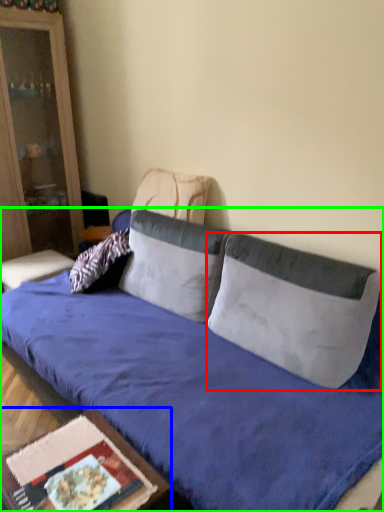
Question: Which object is the farthest from pillow (highlighted by a red box)? Choose among these: table (highlighted by a blue box) or studio couch (highlighted by a green box).

Choices:
 (A) table
 (B) studio couch

Answer: (A)